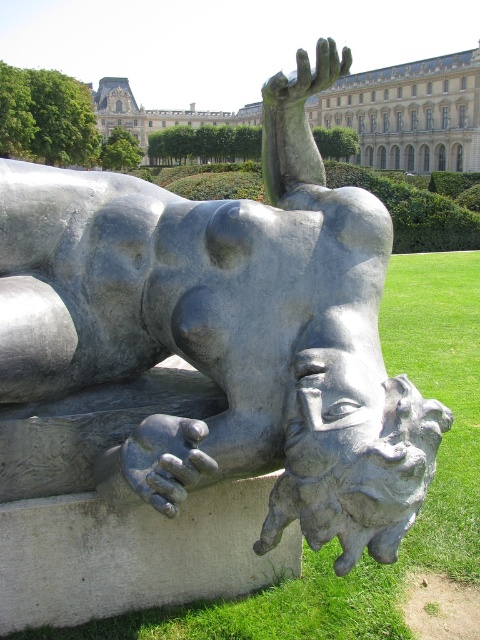
Can you confirm if gray stone building at upper center is thinner than polished silver hand at lower center?

No.

Based on the photo, does gray stone building at upper center have a lesser height compared to polished silver hand at lower center?

No.

Is point (348, 115) less distant than point (180, 490)?

That is False.

Find the location of a particular element. The image size is (480, 640). gray stone building at upper center is located at coordinates (408, 113).

Can you confirm if polished silver hand at lower center is wider than gray stone hand at upper center?

No.

Is point (128, 444) positioned in front of point (327, 49)?

Yes.

The width and height of the screenshot is (480, 640). In order to click on polished silver hand at lower center in this screenshot , I will do `click(165, 460)`.

Can you confirm if gray stone building at upper center is positioned to the right of gray stone hand at upper center?

In fact, gray stone building at upper center is to the left of gray stone hand at upper center.

Is point (393, 115) positioned behind point (286, 100)?

Yes.

At what (x,y) coordinates should I click in order to perform the action: click on gray stone building at upper center. Please return your answer as a coordinate pair (x, y). The height and width of the screenshot is (640, 480). Looking at the image, I should click on (408, 113).